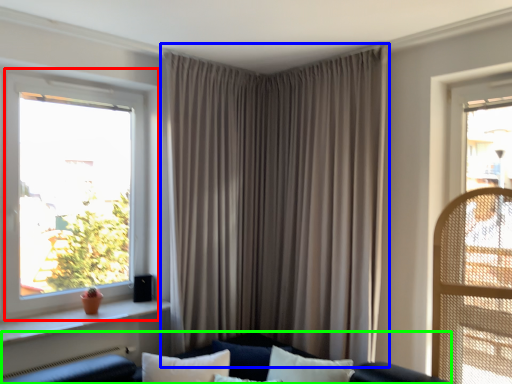
Question: Which is nearer to the window (highlighted by a red box)? curtain (highlighted by a blue box) or couch (highlighted by a green box).

Choices:
 (A) curtain
 (B) couch

Answer: (A)